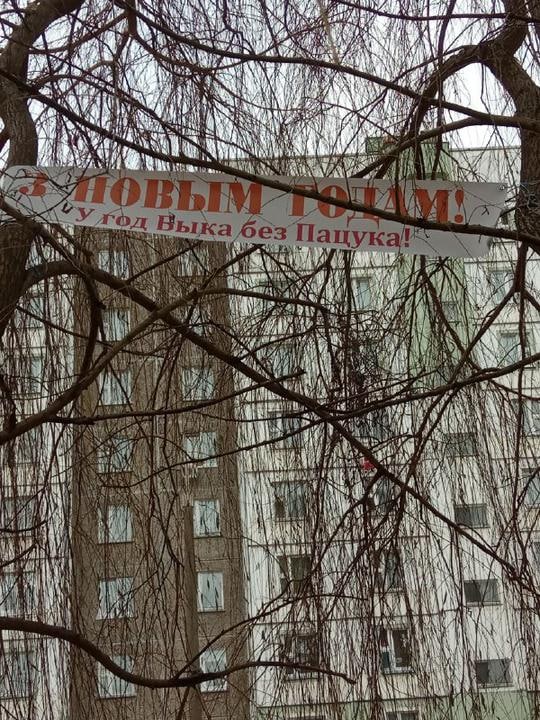
Where is `window`? The image size is (540, 720). window is located at coordinates (292, 489).